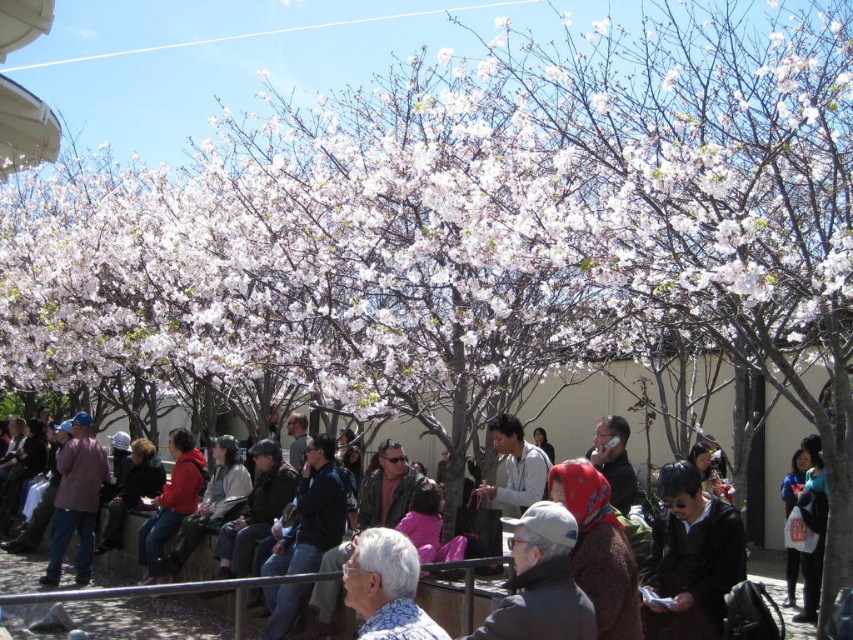
Does dark gray sweater at center have a greater height compared to gray fabric cap at center?

Indeed, dark gray sweater at center has a greater height compared to gray fabric cap at center.

Is dark gray sweater at center thinner than gray fabric cap at center?

No, dark gray sweater at center is not thinner than gray fabric cap at center.

At what (x,y) coordinates should I click in order to perform the action: click on dark gray sweater at center. Please return your answer as a coordinate pair (x, y). The image size is (853, 640). Looking at the image, I should click on (691, 557).

Which is behind, point (450, 568) or point (82, 518)?

Point (82, 518)

Which is in front, point (450, 612) or point (78, 544)?

Point (450, 612) is in front.

Find the location of a particular element. This screenshot has width=853, height=640. matte black jacket at center is located at coordinates (456, 602).

Does matte pink jacket at left appear on the right side of white paper airplane at upper center?

Correct, you'll find matte pink jacket at left to the right of white paper airplane at upper center.

Consider the image. Can you confirm if matte pink jacket at left is positioned to the left of white paper airplane at upper center?

Incorrect, matte pink jacket at left is not on the left side of white paper airplane at upper center.

Does point (80, 481) come in front of point (395, 17)?

Yes, it is.

Where is `matte pink jacket at left`? Image resolution: width=853 pixels, height=640 pixels. matte pink jacket at left is located at coordinates (76, 500).